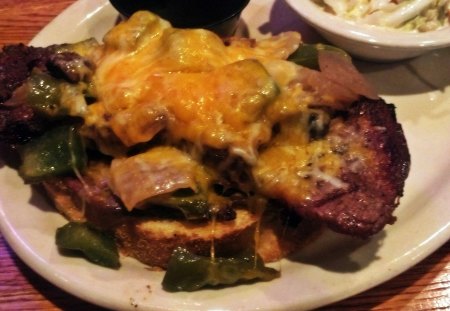
Locate an element on the screen. The image size is (450, 311). edge of round white bowl is located at coordinates (366, 42).